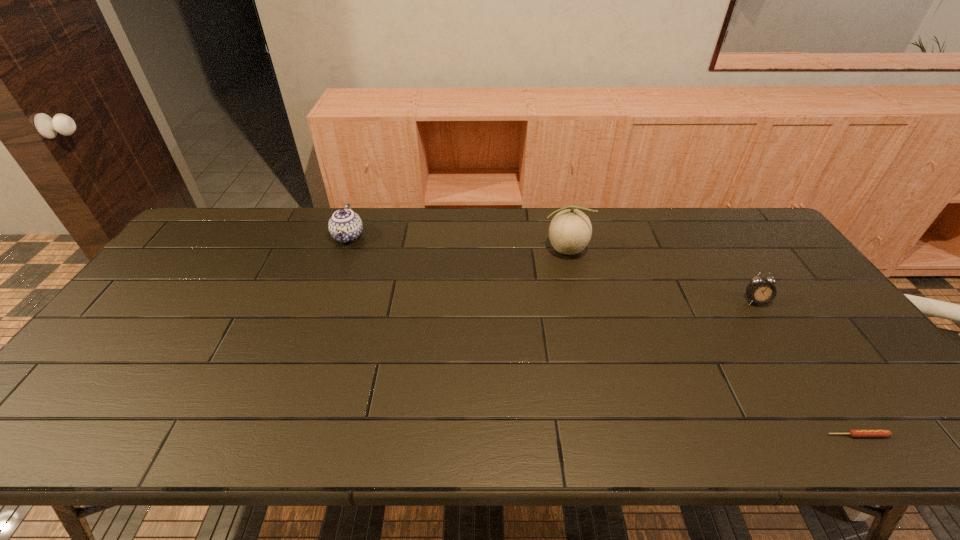
Find the location of `vacant region that satisfies the following two spatial constraints: 1. on the face of the third tallest object; 2. on the left side of the sausage`. vacant region that satisfies the following two spatial constraints: 1. on the face of the third tallest object; 2. on the left side of the sausage is located at coordinates (844, 435).

Identify the location of free location that satisfies the following two spatial constraints: 1. from the spout of the tallest object; 2. on the left side of the leftmost object. The image size is (960, 540). (343, 250).